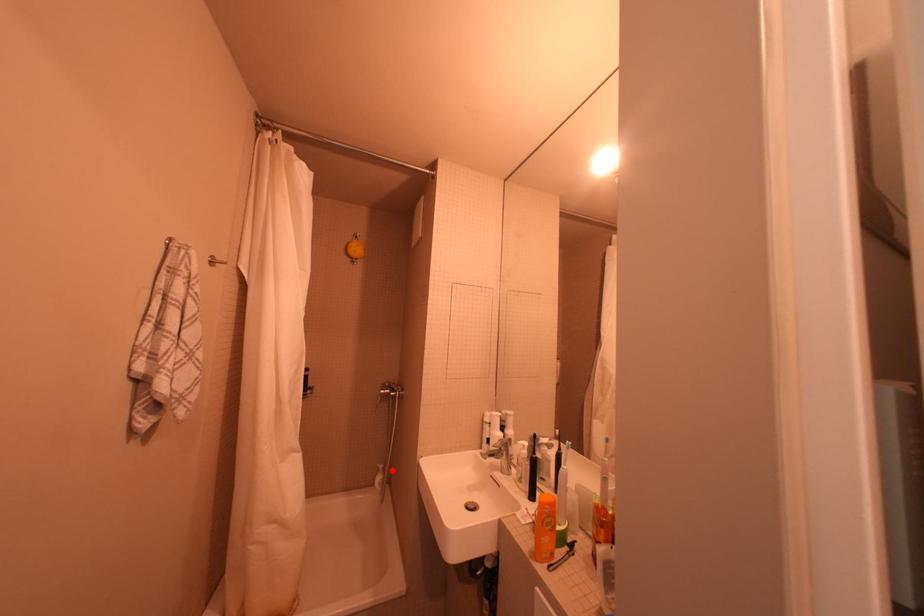
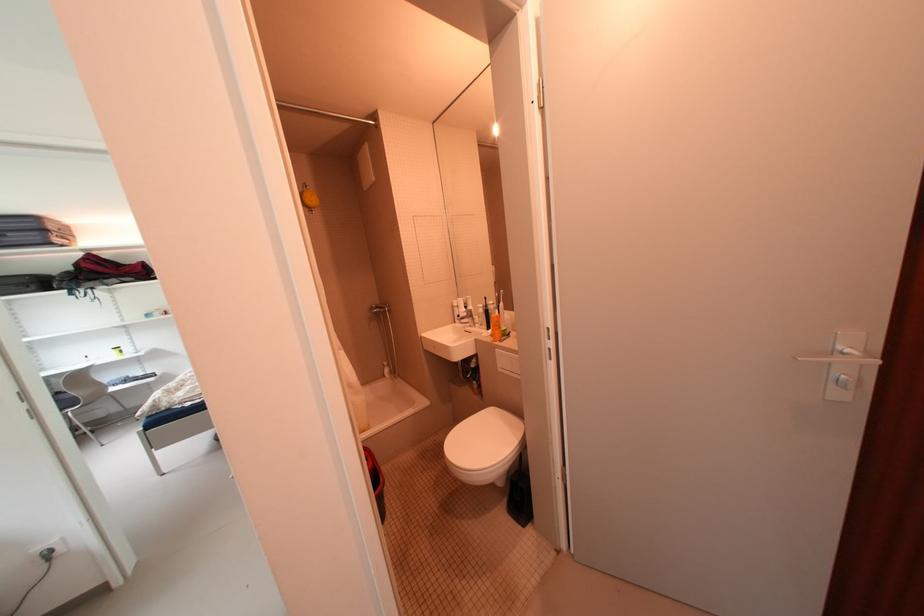
The point at the highlighted location is marked in the first image. Where is the corresponding point in the second image?

(396, 365)